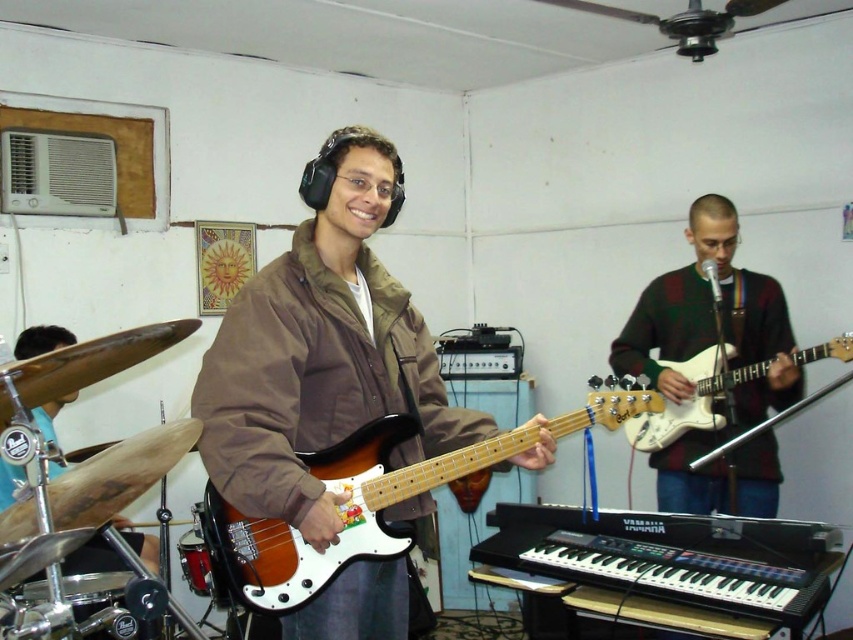
You are standing in the room where the music session is happening. You need to locate the brown fabric jacket at center. Where exactly is it positioned in the room?

The brown fabric jacket at center is located at the coordinates point (322,349).

You are a photographer setting up a shoot in this music session. You need to place a 10cm wide decorative item between the green sweater at center and the white glossy electric guitar at right. Can you fit it there based on their widths?

The green sweater at center is thinner than the white glossy electric guitar at right, so the 10cm wide decorative item can be placed between them as there is enough space.

You are a photographer setting up for a music session. You need to place a spotlight on the brown fabric jacket at center so it doesn not shine on the brushed metal drum at lower left. Based on their positions, which side of the jacket should you aim the spotlight to avoid the drum?

The brown fabric jacket at center is positioned on the right side of the brushed metal drum at lower left. To avoid shining on the drum, aim the spotlight to the left side of the jacket.